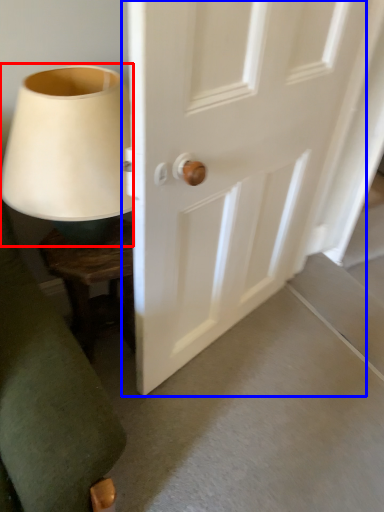
Question: Which of the following is the closest to the observer, table lamp (highlighted by a red box) or door (highlighted by a blue box)?

Choices:
 (A) table lamp
 (B) door

Answer: (B)